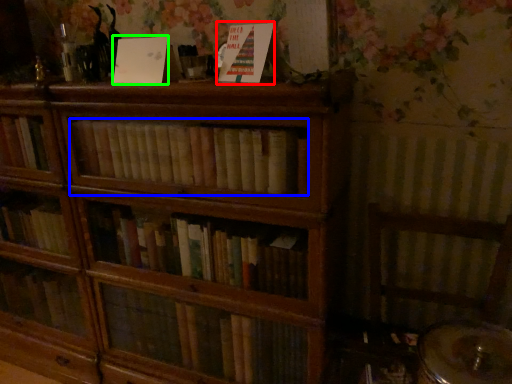
Question: Based on their relative distances, which object is nearer to paperback book (highlighted by a red box)? Choose from book (highlighted by a blue box) and paperback book (highlighted by a green box).

Choices:
 (A) book
 (B) paperback book

Answer: (B)